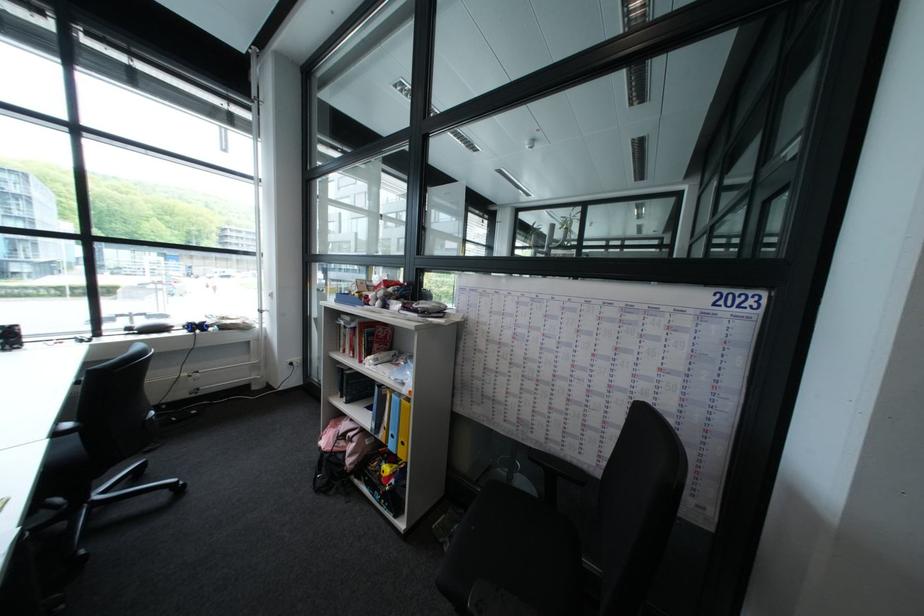
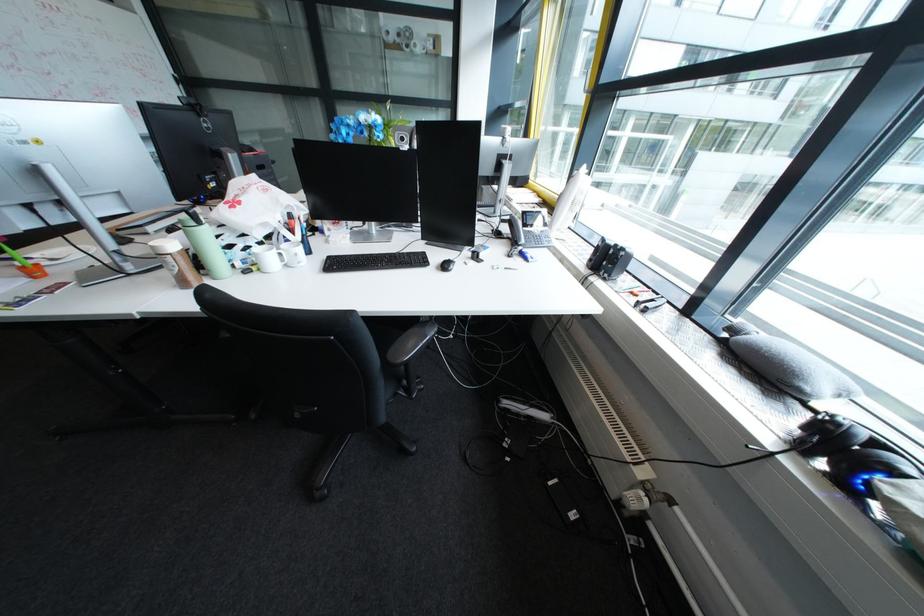
In the second image, find the point that corresponds to (x=219, y=323) in the first image.

(909, 474)